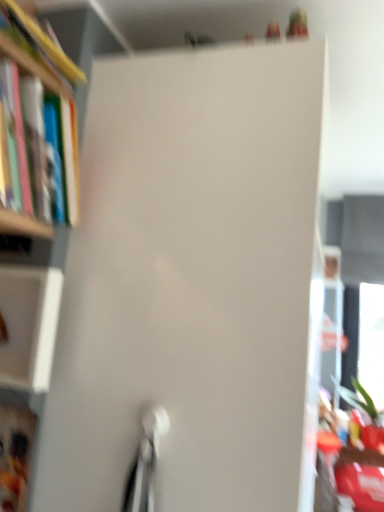
Question: Should I look upward or downward to see hardcover book at left, the second book when ordered from top to bottom?

Choices:
 (A) up
 (B) down

Answer: (A)

Question: Can you confirm if hardcover book at left, acting as the 1th book starting from the top, is smaller than matte plastic cabinet at lower left, the second cabinet from the top?

Choices:
 (A) no
 (B) yes

Answer: (A)

Question: From a real-world perspective, is hardcover book at left, which is the second book from bottom to top, under matte plastic cabinet at lower left, which appears as the 1th cabinet when ordered from the bottom?

Choices:
 (A) no
 (B) yes

Answer: (A)

Question: Considering the relative sizes of hardcover book at left, acting as the 1th book starting from the top, and matte plastic cabinet at lower left, which appears as the 1th cabinet when ordered from the bottom, in the image provided, is hardcover book at left, acting as the 1th book starting from the top, taller than matte plastic cabinet at lower left, which appears as the 1th cabinet when ordered from the bottom,?

Choices:
 (A) yes
 (B) no

Answer: (B)

Question: Can matte plastic cabinet at lower left, the second cabinet from the top, be found inside hardcover book at left, which is the second book from bottom to top?

Choices:
 (A) no
 (B) yes

Answer: (A)

Question: Is hardcover book at left, acting as the 1th book starting from the top, to the left of matte plastic cabinet at lower left, the second cabinet from the top, from the viewer's perspective?

Choices:
 (A) no
 (B) yes

Answer: (A)

Question: Considering the relative sizes of hardcover book at left, acting as the 1th book starting from the top, and matte plastic cabinet at lower left, which appears as the 1th cabinet when ordered from the bottom, in the image provided, is hardcover book at left, acting as the 1th book starting from the top, thinner than matte plastic cabinet at lower left, which appears as the 1th cabinet when ordered from the bottom,?

Choices:
 (A) no
 (B) yes

Answer: (A)

Question: Considering the relative positions of white matte cabinet at left, placed as the first cabinet when sorted from top to bottom, and hardcover book at left, which is the second book from bottom to top, in the image provided, is white matte cabinet at left, placed as the first cabinet when sorted from top to bottom, behind hardcover book at left, which is the second book from bottom to top,?

Choices:
 (A) no
 (B) yes

Answer: (B)

Question: Is white matte cabinet at left, placed as the first cabinet when sorted from top to bottom, not near hardcover book at left, which is the second book from bottom to top?

Choices:
 (A) yes
 (B) no

Answer: (B)

Question: Does white matte cabinet at left, the second cabinet from the bottom, appear on the left side of hardcover book at left, which is the second book from bottom to top?

Choices:
 (A) yes
 (B) no

Answer: (A)

Question: Could you tell me if white matte cabinet at left, the second cabinet from the bottom, is turned towards hardcover book at left, which is the second book from bottom to top?

Choices:
 (A) no
 (B) yes

Answer: (A)

Question: From a real-world perspective, is white matte cabinet at left, placed as the first cabinet when sorted from top to bottom, physically above hardcover book at left, which is the second book from bottom to top?

Choices:
 (A) yes
 (B) no

Answer: (B)

Question: Is white matte cabinet at left, the second cabinet from the bottom, not within hardcover book at left, acting as the 1th book starting from the top?

Choices:
 (A) no
 (B) yes

Answer: (B)

Question: Is hardcover book at left, which is counted as the 1th book, starting from the bottom, shorter than hardcover book at left, which is the second book from bottom to top?

Choices:
 (A) yes
 (B) no

Answer: (B)